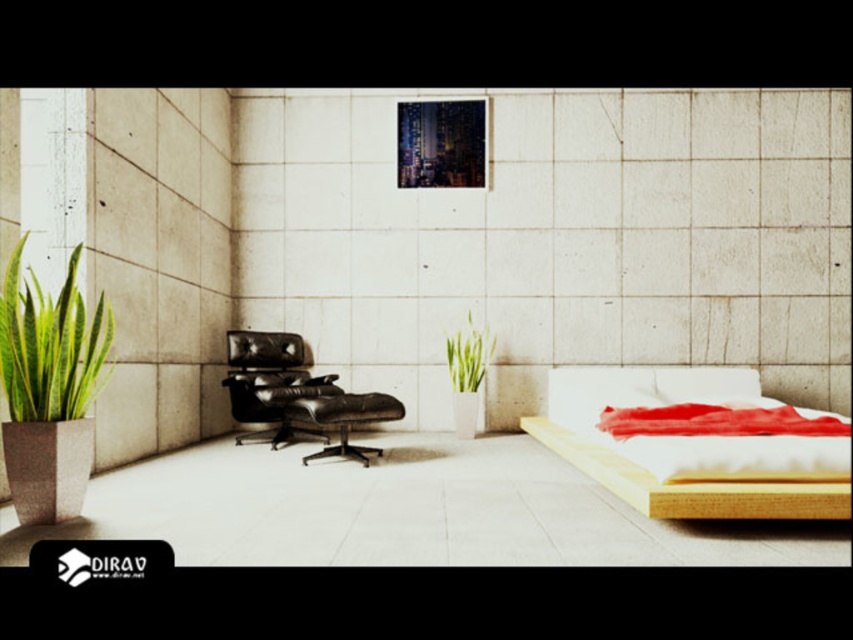
Which is behind, point (747, 369) or point (462, 353)?

Point (747, 369)

The width and height of the screenshot is (853, 640). Find the location of `white soft pillow at center`. white soft pillow at center is located at coordinates (706, 385).

The height and width of the screenshot is (640, 853). I want to click on white soft pillow at center, so click(706, 385).

Measure the distance between point (57, 326) and camera.

Point (57, 326) is 9.83 feet away from camera.

Who is higher up, green leafy plant at left or green matte plant at center?

green leafy plant at left

Describe the element at coordinates (50, 344) in the screenshot. I see `green leafy plant at left` at that location.

I want to click on green leafy plant at left, so click(x=50, y=344).

Between black leather swivel chair at center and white soft pillow at center, which one has more height?

black leather swivel chair at center is taller.

What do you see at coordinates (270, 384) in the screenshot? I see `black leather swivel chair at center` at bounding box center [270, 384].

Measure the distance between point (281, 376) and camera.

Point (281, 376) and camera are 5.83 meters apart from each other.

I want to click on black leather swivel chair at center, so click(270, 384).